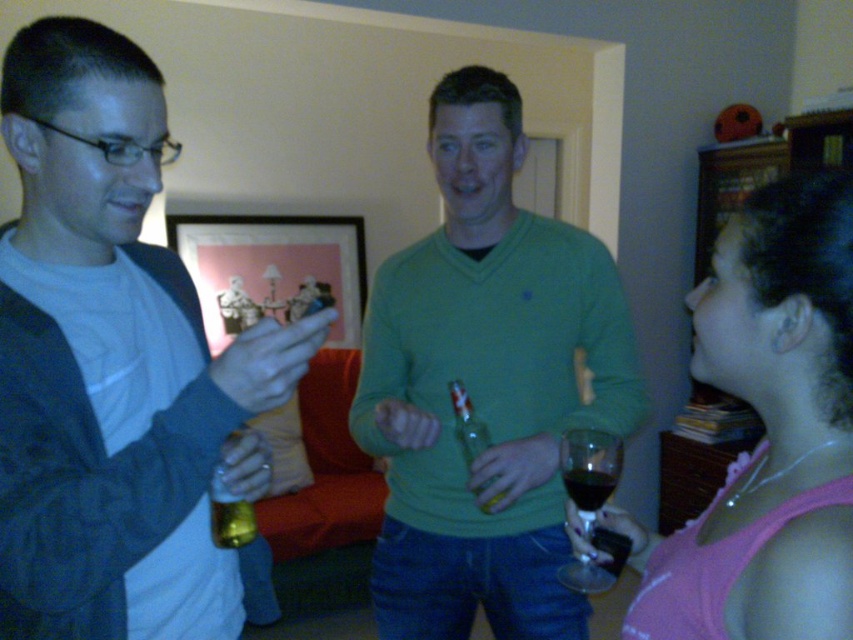
Based on the photo, you are a photographer at the event and want to capture a photo that includes both the green matte sweater at center and the translucent glass bottle at center. Which object should you focus on first to ensure both are in frame?

Since the green matte sweater at center is taller than the translucent glass bottle at center, you should focus on the green matte sweater at center first to ensure both are in frame.

You are at a party and want to grab a drink. There is a transparent glass at center and a gold metallic can at center. Which one is closer to your right hand if you are facing the scene?

The transparent glass at center is to the right of the gold metallic can at center, so it would be closer to your right hand if you are facing the scene.